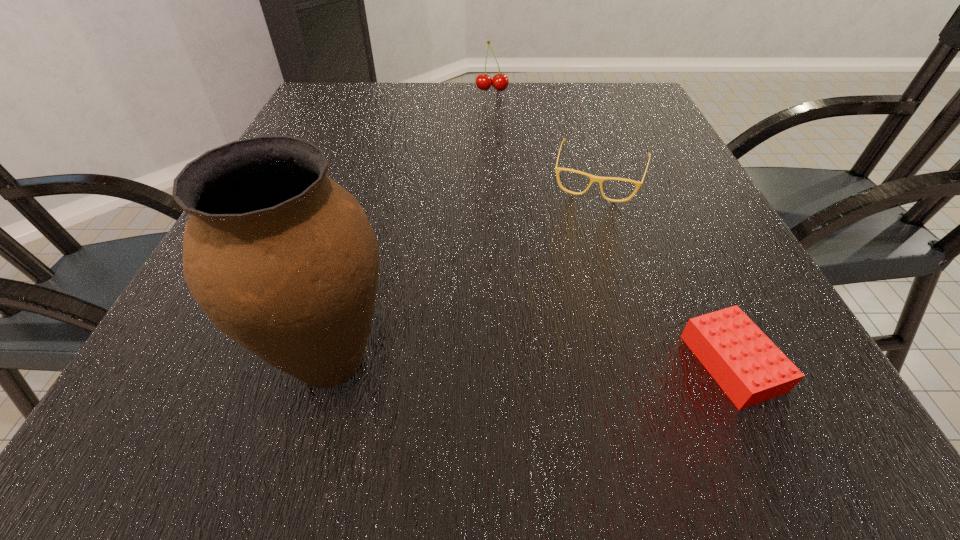
The image size is (960, 540). Find the location of `object that is at the near left corner`. object that is at the near left corner is located at coordinates (284, 260).

Find the location of a particular element. The width and height of the screenshot is (960, 540). object located at the near right corner is located at coordinates (747, 365).

This screenshot has height=540, width=960. Find the location of `vacant region at the far edge of the desktop`. vacant region at the far edge of the desktop is located at coordinates (474, 94).

Image resolution: width=960 pixels, height=540 pixels. I want to click on vacant region at the near edge of the desktop, so click(634, 372).

I want to click on vacant area at the right edge of the desktop, so click(665, 236).

You are a GUI agent. You are given a task and a screenshot of the screen. Output one action in this format:
    pyautogui.click(x=<x>, y=<y>)
    Task: Click on the free space at the near left corner of the desktop
    
    Given the screenshot: What is the action you would take?
    pyautogui.click(x=252, y=364)

You are a GUI agent. You are given a task and a screenshot of the screen. Output one action in this format:
    pyautogui.click(x=<x>, y=<y>)
    Task: Click on the free location at the far right corner
    Image resolution: width=960 pixels, height=540 pixels.
    Given the screenshot: What is the action you would take?
    pyautogui.click(x=620, y=97)

I want to click on free space between the Lego and the urn, so click(531, 361).

Image resolution: width=960 pixels, height=540 pixels. I want to click on free point between the tallest object and the cherry, so (x=412, y=225).

Identify the location of free point between the Lego and the cherry. (612, 226).